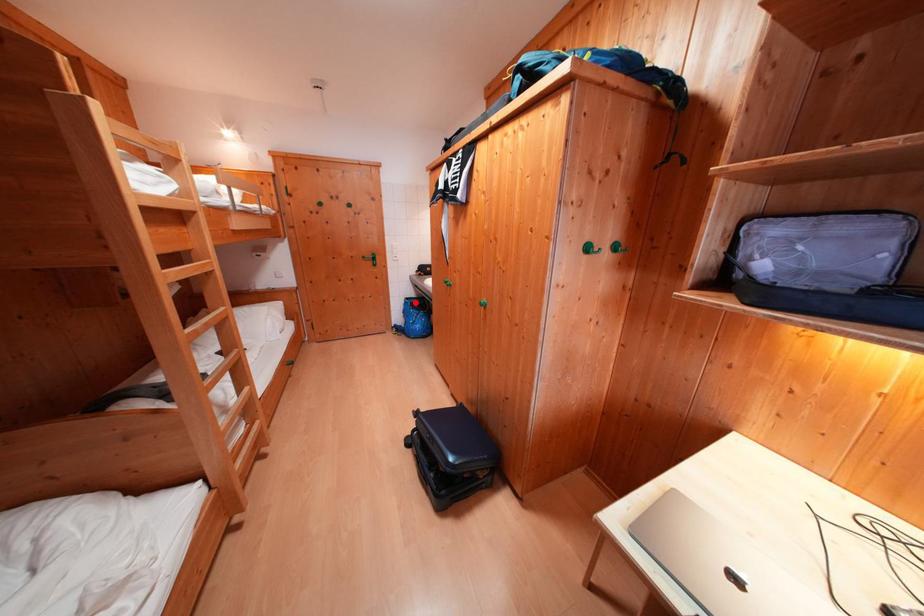
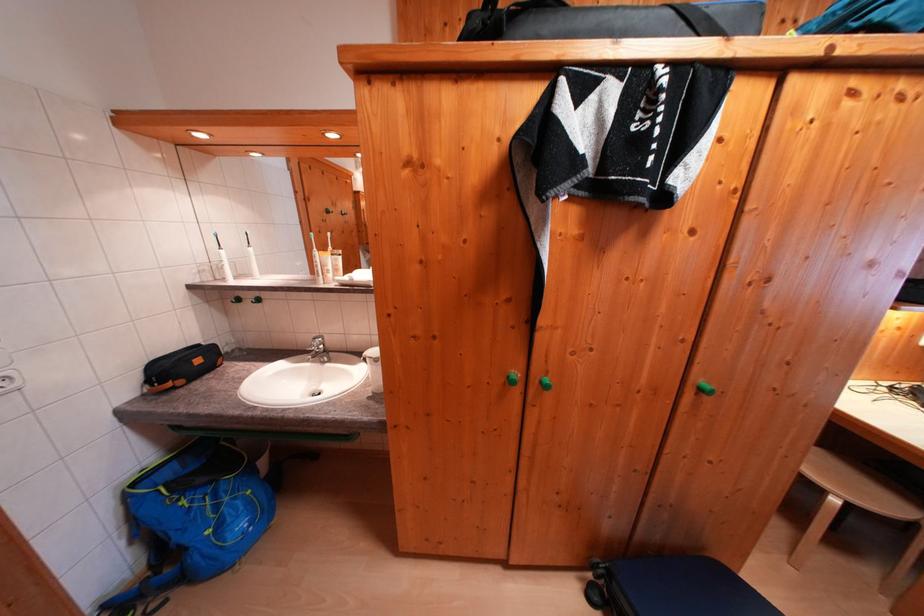
The point at the highlighted location is marked in the first image. Where is the corresponding point in the second image?

(142, 488)